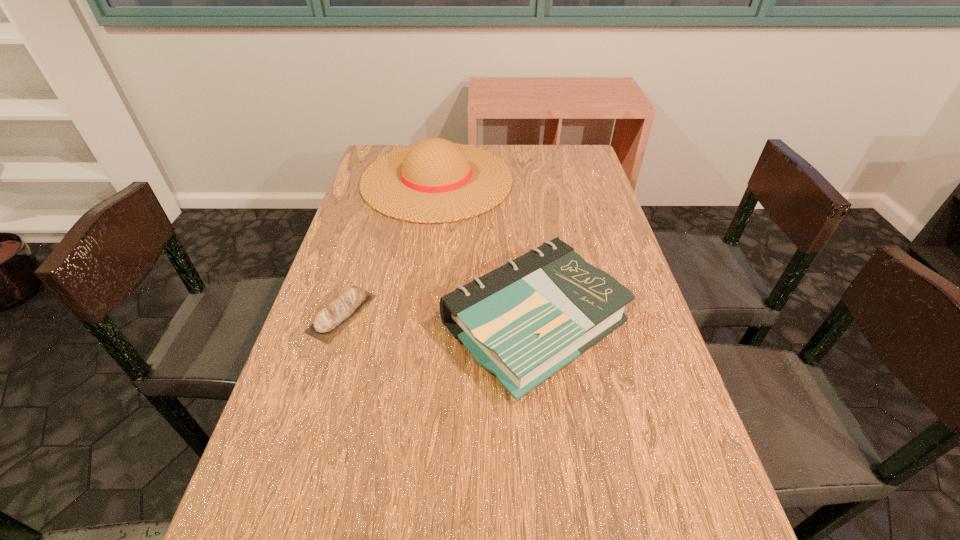
What are the coordinates of `free space between the shortest object and the paperback book` in the screenshot? It's located at (438, 319).

Find the location of `vacant space that's between the second tallest object and the bonnet`. vacant space that's between the second tallest object and the bonnet is located at coordinates click(x=485, y=252).

This screenshot has width=960, height=540. Find the location of `free space between the tallest object and the pita bread`. free space between the tallest object and the pita bread is located at coordinates (390, 247).

Identify which object is located as the nearest to the bonnet. Please provide its 2D coordinates. Your answer should be formatted as a tuple, i.e. [(x, y)], where the tuple contains the x and y coordinates of a point satisfying the conditions above.

[(524, 321)]

Find the location of a particular element. This screenshot has width=960, height=540. the closest object relative to the farthest object is located at coordinates (524, 321).

Find the location of a particular element. blank space that satisfies the following two spatial constraints: 1. on the back side of the shortest object; 2. on the right side of the farthest object is located at coordinates [383, 180].

Find the location of a particular element. free space in the image that satisfies the following two spatial constraints: 1. on the front side of the paperback book; 2. on the left side of the shortest object is located at coordinates (339, 324).